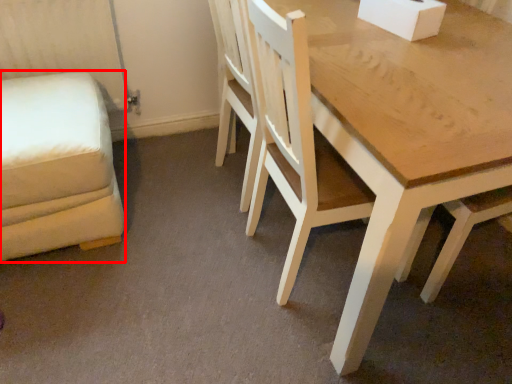
Question: Observing the image, what is the correct spatial positioning of swivel chair (annotated by the red box) in reference to chair?

Choices:
 (A) left
 (B) right

Answer: (A)